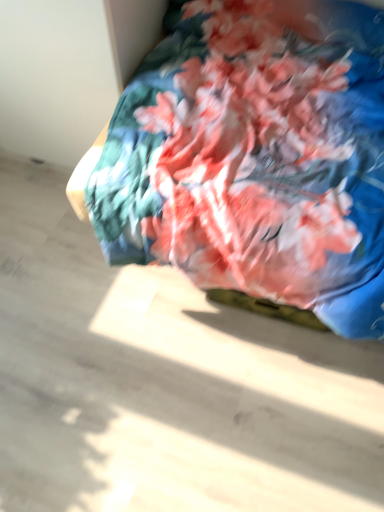
In order to click on floral fabric bed at upper center in this screenshot , I will do `click(253, 159)`.

What do you see at coordinates (253, 159) in the screenshot? This screenshot has width=384, height=512. I see `floral fabric bed at upper center` at bounding box center [253, 159].

Identify the location of floral fabric bed at upper center. click(253, 159).